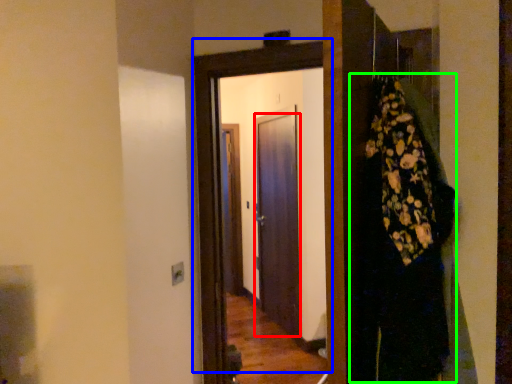
Question: Based on their relative distances, which object is farther from door (highlighted by a red box)? Choose from door (highlighted by a blue box) and dress (highlighted by a green box).

Choices:
 (A) door
 (B) dress

Answer: (B)